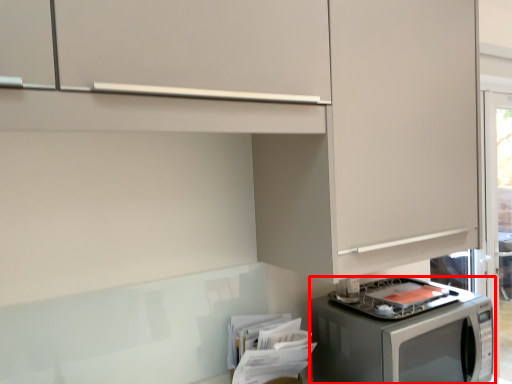
Question: In this image, where is home appliance (annotated by the red box) located relative to cabinetry?

Choices:
 (A) left
 (B) right

Answer: (B)